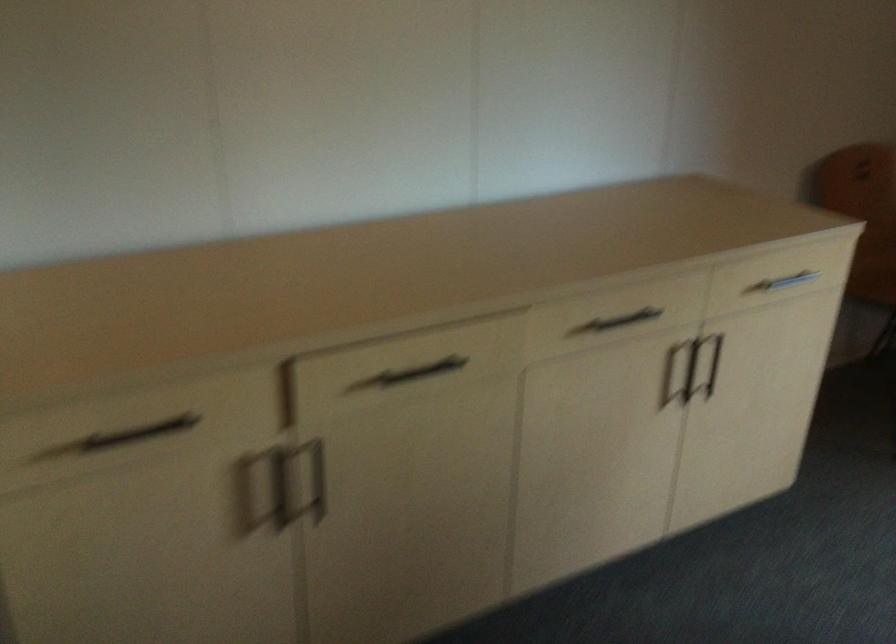
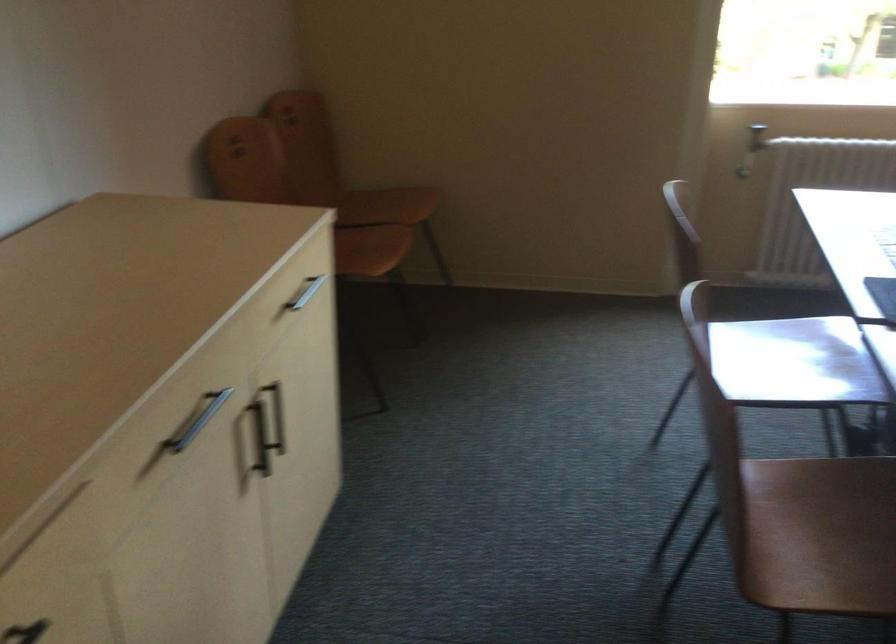
The point at [797,283] is marked in the first image. Where is the corresponding point in the second image?

(305, 292)